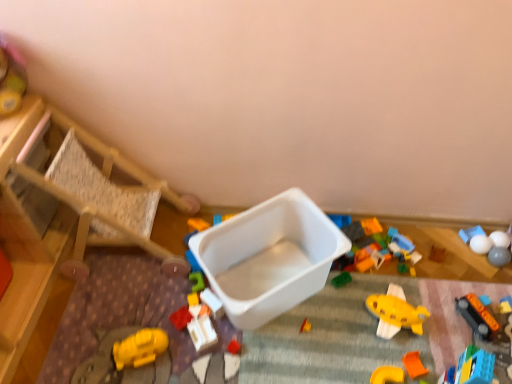
Locate an element on the screen. Image resolution: width=512 pixels, height=384 pixels. free space that is to the left of orange plastic train at lower right, which is the 5th toy in right-to-left order is located at coordinates (431, 331).